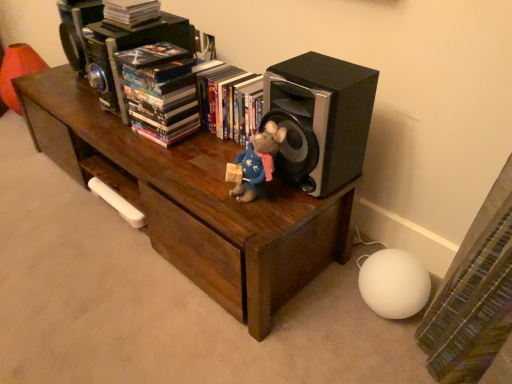
Find the location of a particular element. vacant space to the right of velvety blue plush at center is located at coordinates pyautogui.click(x=301, y=193).